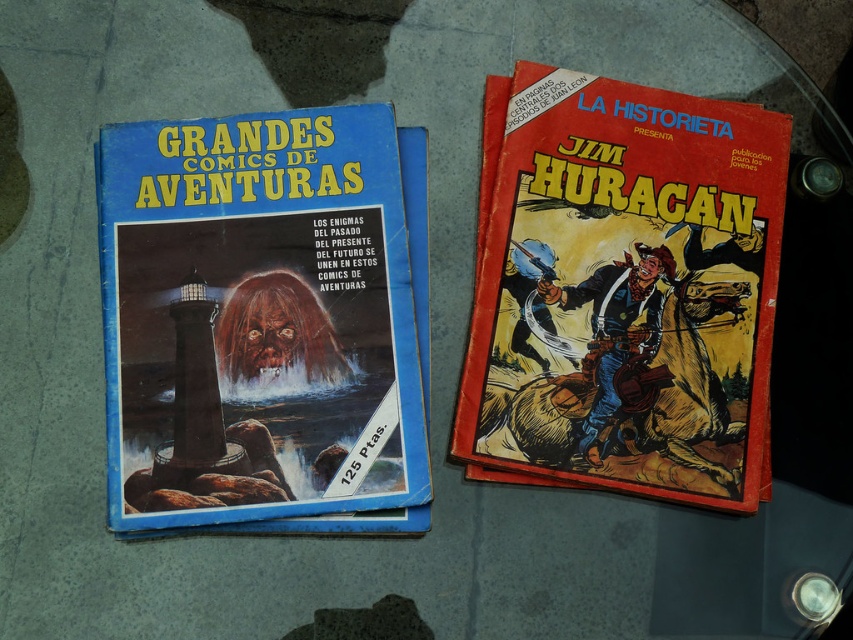
You are a collector organizing comic books on a shelf. You have two comic books in front of you, the blue paper comic book at left and the red matte comic book at right. Based on their positions, which one is closer to the bottom edge of the shelf?

The blue paper comic book at left is closer to the bottom edge of the shelf because it is positioned below the red matte comic book at right.

You are a collector organizing comic books on a shelf. You have a blue paper comic book at left and a red matte comic book at right. Which comic book is located to the left of the other?

The blue paper comic book at left is positioned on the left side of the red matte comic book at right, so the blue paper comic book at left is to the left of the red matte comic book at right.